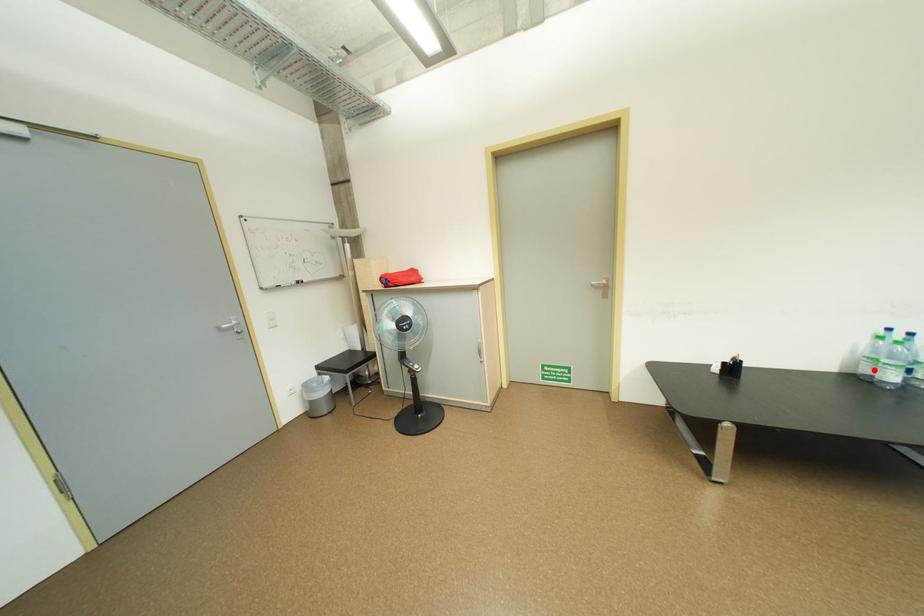
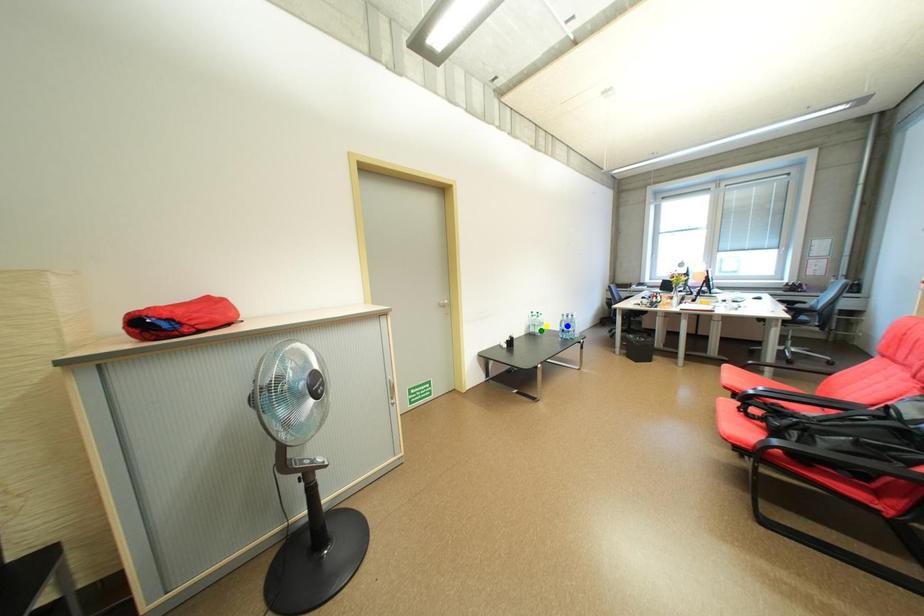
Question: I am providing you with two images of the same scene from different viewpoints. A red point is marked on the first image. You are given multiple points on the second image. Which point in image 2 represents the same 3d spot as the red point in image 1?

Choices:
 (A) green point
 (B) blue point
 (C) yellow point

Answer: (A)